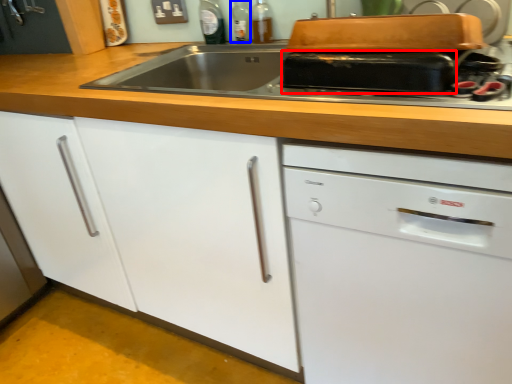
Question: Which object is closer to the camera taking this photo, kitchen appliance (highlighted by a red box) or bottle (highlighted by a blue box)?

Choices:
 (A) kitchen appliance
 (B) bottle

Answer: (A)